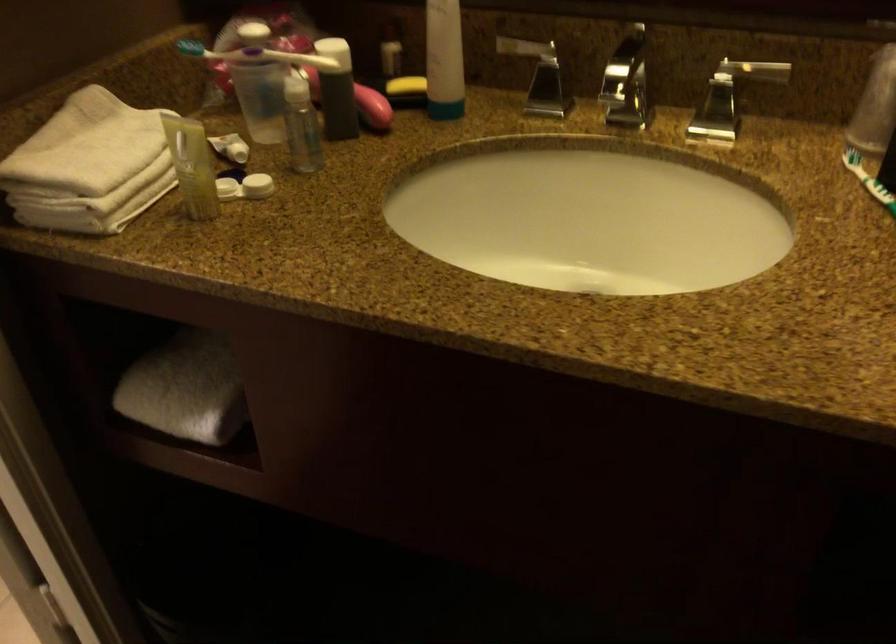
Image resolution: width=896 pixels, height=644 pixels. Find the location of `bottle pump`. bottle pump is located at coordinates (334, 52).